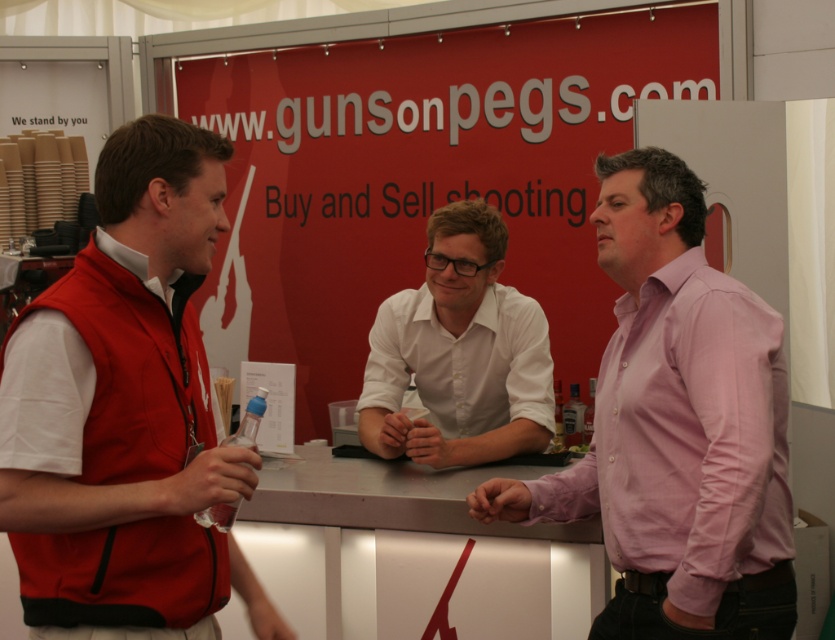
Does matte red vest at left appear on the right side of pink cotton shirt at right?

In fact, matte red vest at left is to the left of pink cotton shirt at right.

Which of these two, matte red vest at left or pink cotton shirt at right, stands shorter?

With less height is pink cotton shirt at right.

Between point (100, 188) and point (641, 472), which one is positioned behind?

The point (641, 472) is more distant.

Identify the location of matte red vest at left. (124, 412).

Is point (124, 496) in front of point (243, 481)?

Yes, point (124, 496) is in front of point (243, 481).

Can you confirm if matte red vest at left is positioned above clear plastic bottle at center?

Indeed, matte red vest at left is positioned over clear plastic bottle at center.

Is point (213, 563) behind point (225, 500)?

Yes, point (213, 563) is farther from viewer.

In order to click on matte red vest at left in this screenshot , I will do (124, 412).

Is clear plastic bottle at center below smooth skin hand at center?

Incorrect, clear plastic bottle at center is not positioned below smooth skin hand at center.

Can you confirm if clear plastic bottle at center is thinner than smooth skin hand at center?

Correct, clear plastic bottle at center's width is less than smooth skin hand at center's.

Where is `clear plastic bottle at center`? This screenshot has height=640, width=835. clear plastic bottle at center is located at coordinates (226, 467).